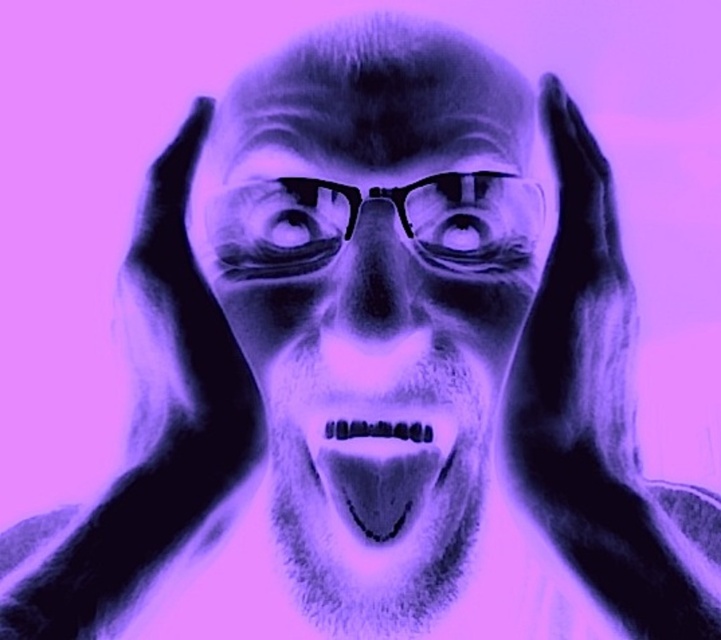
Does translucent purple face at center lie in front of translucent purple mouth at center?

Yes, translucent purple face at center is closer to the viewer.

Who is taller, translucent purple face at center or translucent purple mouth at center?

translucent purple face at center is taller.

Locate an element on the screen. The width and height of the screenshot is (721, 640). translucent purple face at center is located at coordinates (373, 296).